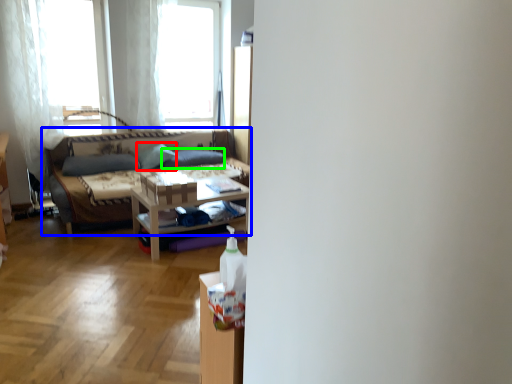
Question: Estimate the real-world distances between objects in this image. Which object is farther from pillow (highlighted by a red box), studio couch (highlighted by a blue box) or pillow (highlighted by a green box)?

Choices:
 (A) studio couch
 (B) pillow

Answer: (A)